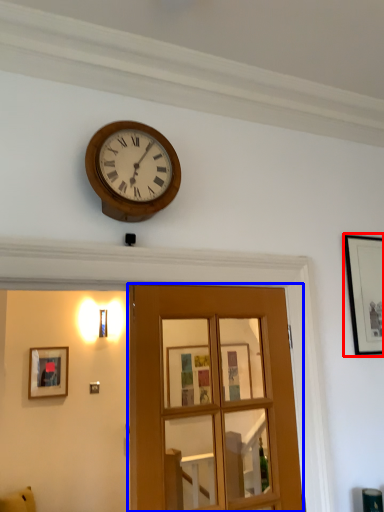
Question: Which object is closer to the camera taking this photo, picture frame (highlighted by a red box) or door (highlighted by a blue box)?

Choices:
 (A) picture frame
 (B) door

Answer: (B)